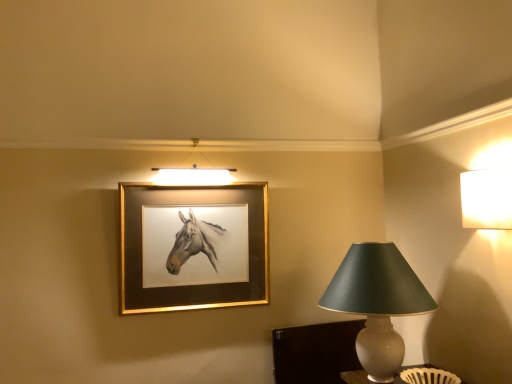
Question: Would you say matte gray lampshade at right, the first lamp ordered from the bottom, is inside or outside gold metallic picture frame at upper center?

Choices:
 (A) inside
 (B) outside

Answer: (B)

Question: From the image's perspective, is matte gray lampshade at right, which is the 1th lamp in left-to-right order, above or below gold metallic picture frame at upper center?

Choices:
 (A) below
 (B) above

Answer: (A)

Question: Based on their relative distances, which object is nearer to the gold metallic picture frame at upper center?

Choices:
 (A) matte gray lampshade at right, which is the 1th lamp in left-to-right order
 (B) white textured lampshade at upper right, which appears as the second lamp when viewed from the left

Answer: (A)

Question: Which is nearer to the gold metallic picture frame at upper center?

Choices:
 (A) white textured lampshade at upper right, placed as the second lamp when sorted from bottom to top
 (B) matte gray lampshade at right, acting as the second lamp starting from the top

Answer: (B)